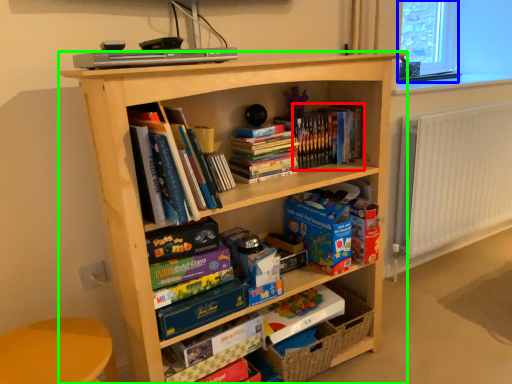
Question: Estimate the real-world distances between objects in this image. Which object is farther from book (highlighted by a red box), window screen (highlighted by a blue box) or bookcase (highlighted by a green box)?

Choices:
 (A) window screen
 (B) bookcase

Answer: (A)